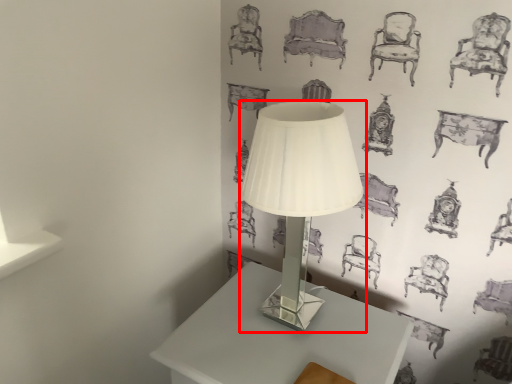
Question: From the image's perspective, where is lamp (annotated by the red box) located relative to table?

Choices:
 (A) below
 (B) above

Answer: (B)